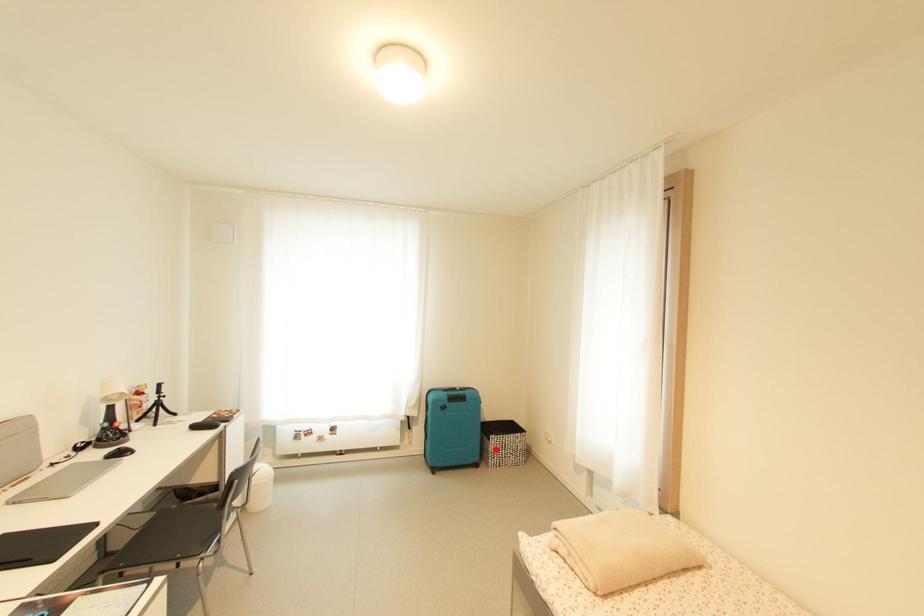
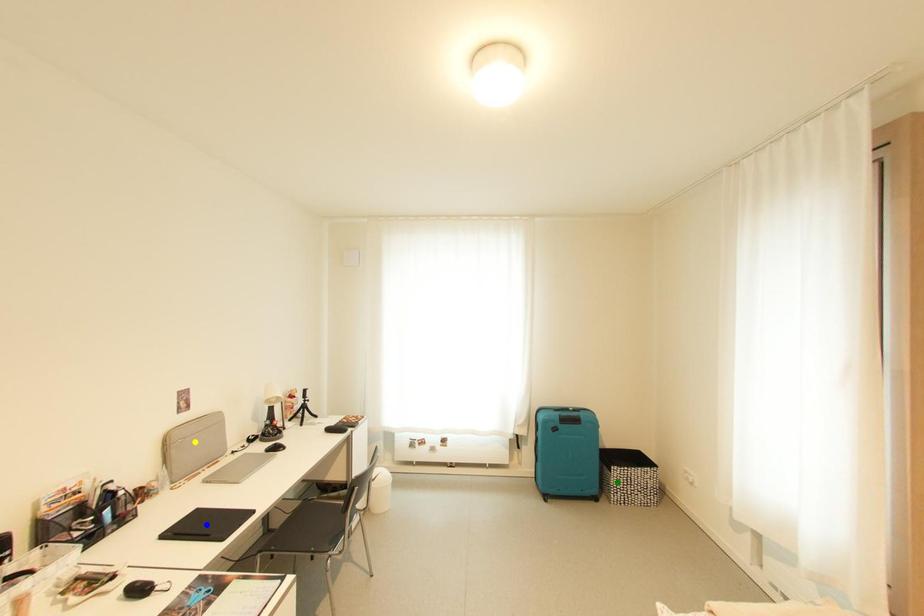
Question: I am providing you with two images of the same scene from different viewpoints. A red point is marked on the first image. You are given multiple points on the second image. Which spot in image 2 lines up with the point in image 1?

Choices:
 (A) green point
 (B) yellow point
 (C) blue point

Answer: (A)